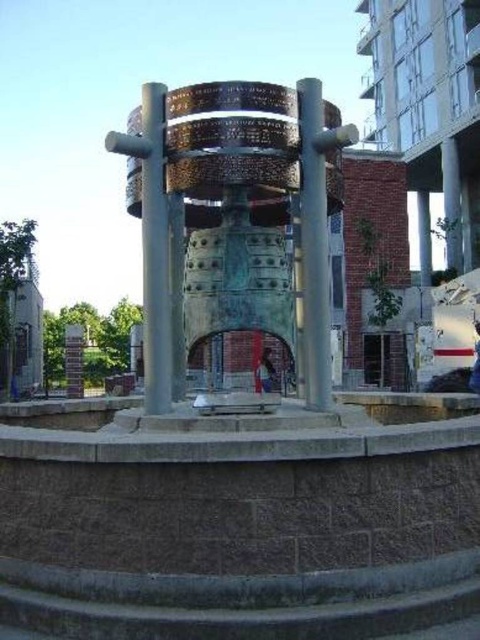
You are standing in front of the architectural structure described. There is a bronze textured bell at center. Where is the point located at coordinates (235, 220)?

The point at coordinates (235, 220) is located on the bronze textured bell at center.

You are standing at the base of the central cylindrical structure in the urban sculpture. There is a metallic polished pole at the center. Can you see the point marked at coordinates (313, 244) on the pole?

The point marked at coordinates (313, 244) corresponds to the location of the metallic polished pole at center. Since the pole is at the center of the structure, you should be able to see the point on the pole from your position at the base.

You are an architect designing a new plaza and want to place a statue in the center. You have two options from the image provided. The bronze textured bell at center and the polished bronze pillar at center. Which one is shorter and would be better suited for a plaza with height restrictions?

The bronze textured bell at center is not as tall as the polished bronze pillar at center, so it would be better suited for a plaza with height restrictions.